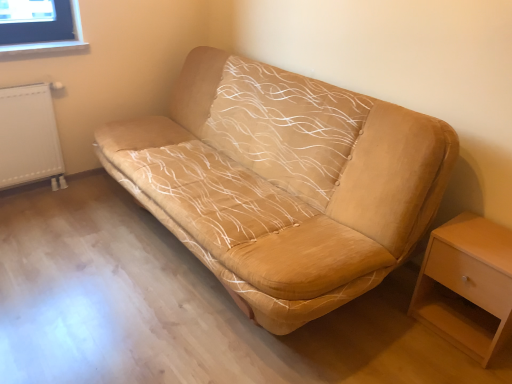
Identify the location of vacant area that lies between beige suede sofa at center and light wood/wooden nightstand at lower right. (402, 354).